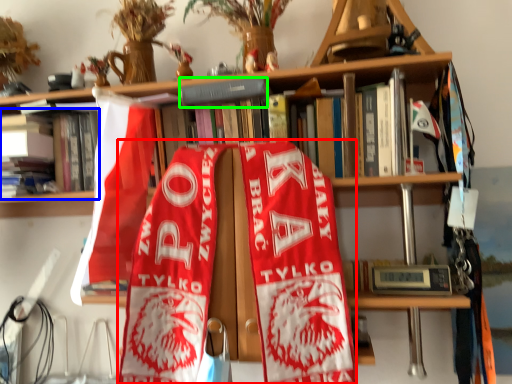
Question: Which is nearer to the beach towel (highlighted by a red box)? book (highlighted by a blue box) or book (highlighted by a green box).

Choices:
 (A) book
 (B) book

Answer: (B)